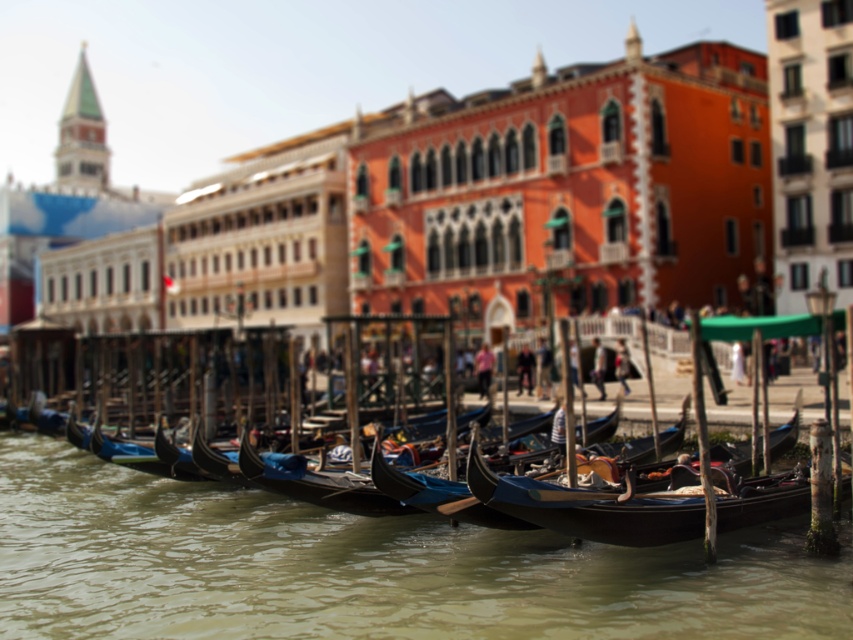
Does greenish water at lower center have a lesser width compared to shiny black gondola at center?

No.

Is greenish water at lower center to the right of shiny black gondola at center from the viewer's perspective?

Incorrect, greenish water at lower center is not on the right side of shiny black gondola at center.

Is point (4, 520) farther from camera compared to point (495, 496)?

Yes, point (4, 520) is behind point (495, 496).

Locate an element on the screen. The width and height of the screenshot is (853, 640). greenish water at lower center is located at coordinates (364, 566).